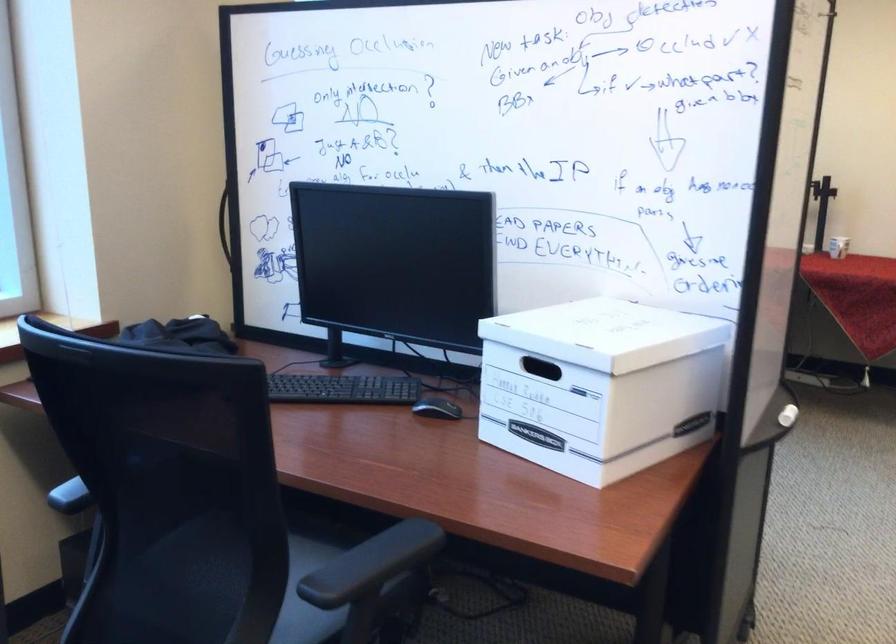
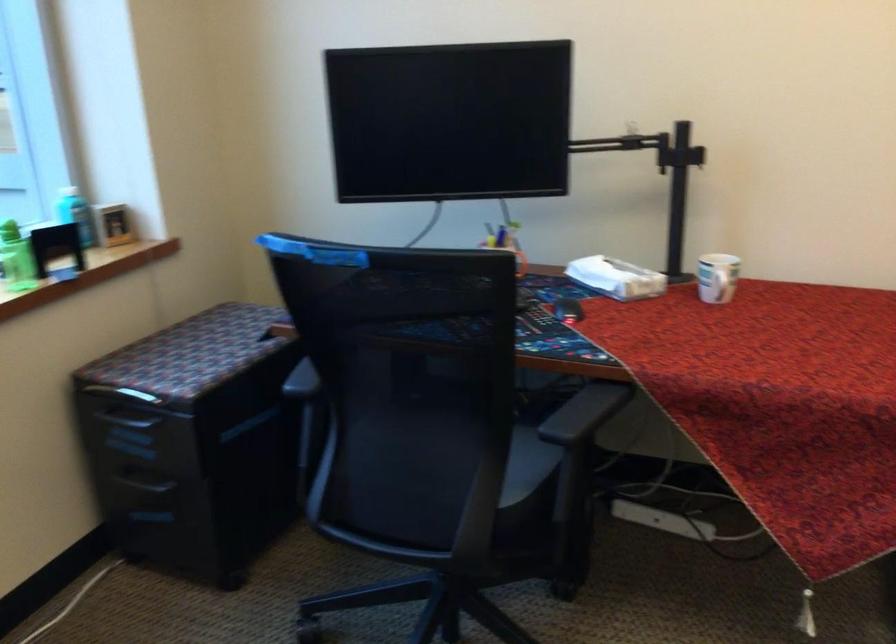
In a continuous first-person perspective shot, in which direction is the camera moving?

The cameraman walked toward right, forward.